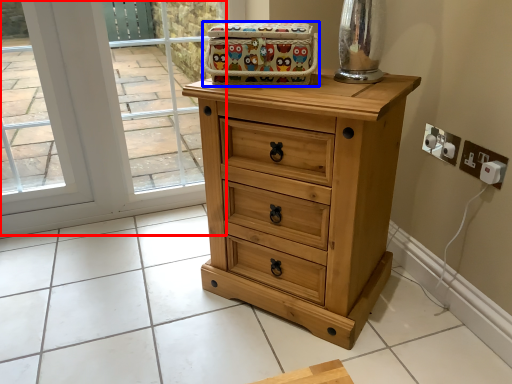
Question: Which point is further to the camera, glass door (highlighted by a red box) or crate (highlighted by a blue box)?

Choices:
 (A) glass door
 (B) crate

Answer: (A)